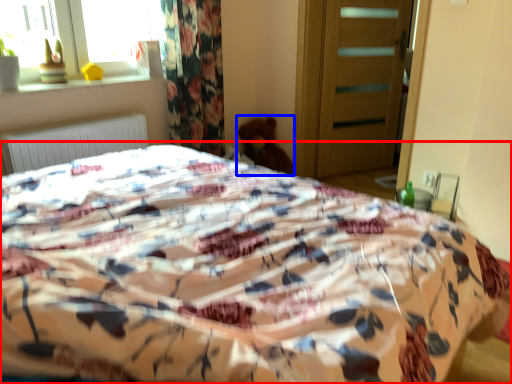
Question: Which object appears farthest to the camera in this image, bed (highlighted by a red box) or teddy (highlighted by a blue box)?

Choices:
 (A) bed
 (B) teddy

Answer: (B)